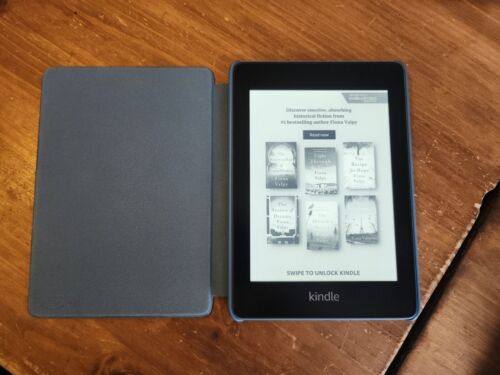
The width and height of the screenshot is (500, 375). Identify the location of wooden tabletop. (442, 195).